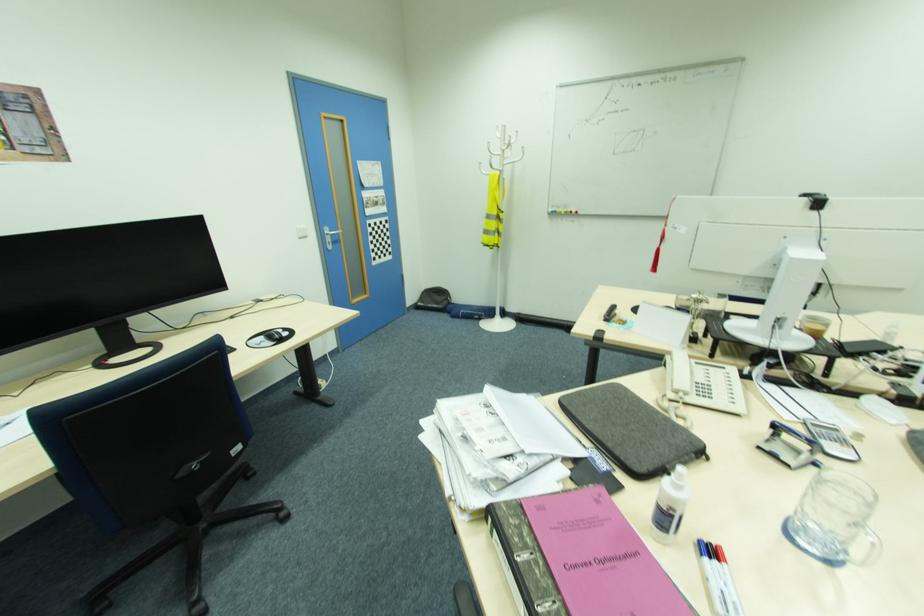
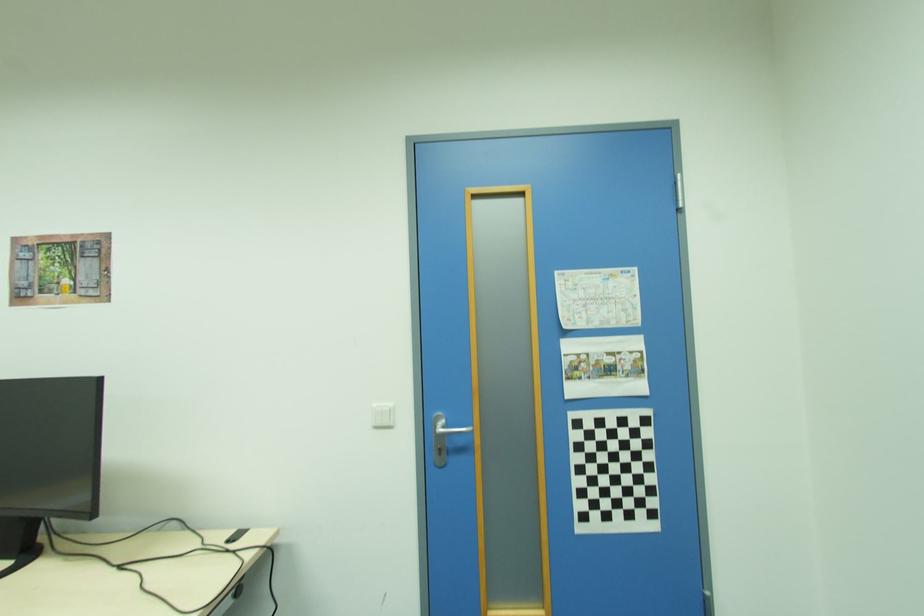
The point at (331, 233) is marked in the first image. Where is the corresponding point in the second image?

(439, 429)